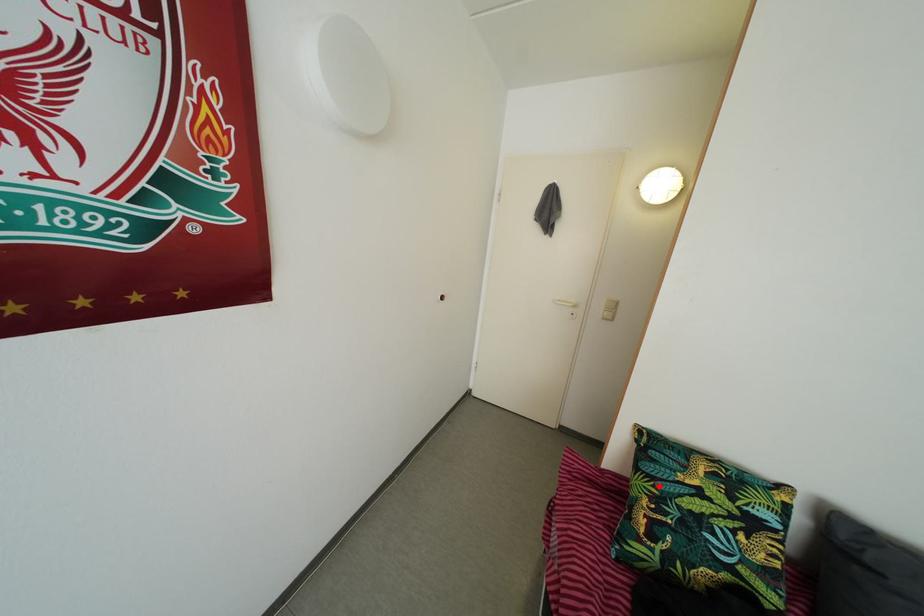
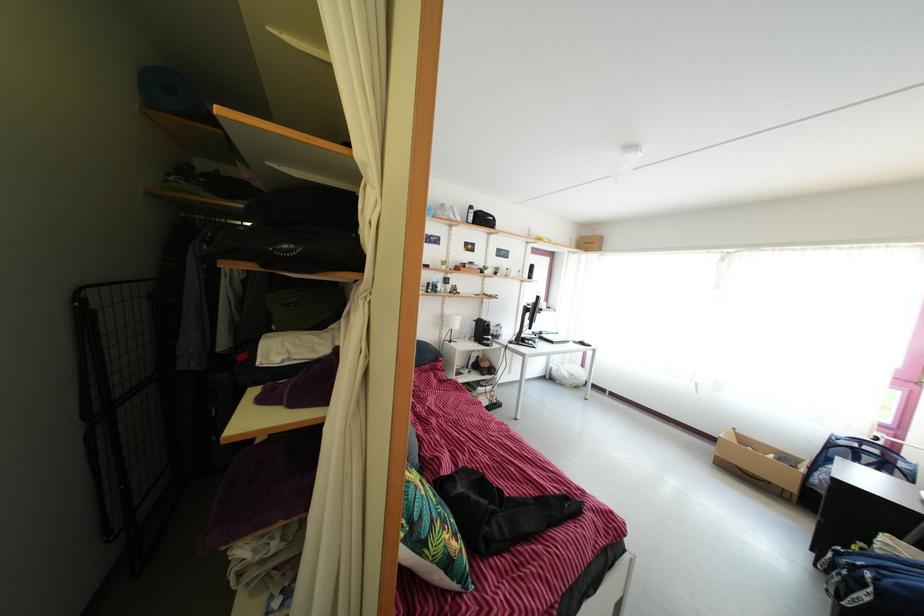
In the second image, find the point that corresponds to the highlighted location in the first image.

(439, 531)